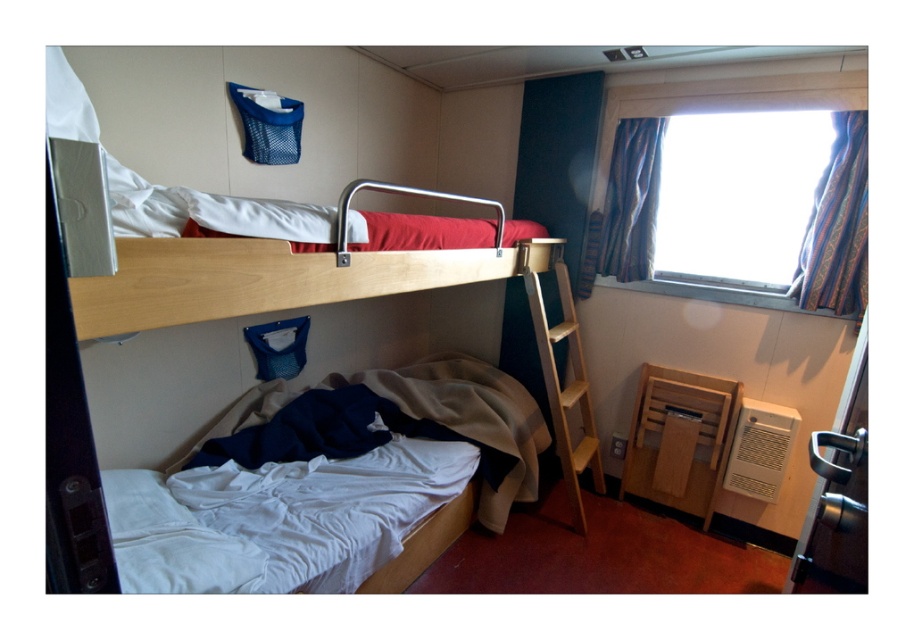
Question: Does multicolored woven curtain at window appear on the left side of wooden at right?

Choices:
 (A) no
 (B) yes

Answer: (A)

Question: Among these objects, which one is nearest to the camera?

Choices:
 (A) wooden bunk bed at center
 (B) striped fabric curtain at window
 (C) wooden at right
 (D) white cotton bed at lower left

Answer: (A)

Question: Can you confirm if wooden bunk bed at center is positioned to the right of translucent glass window at upper right?

Choices:
 (A) yes
 (B) no

Answer: (B)

Question: Which of these objects is positioned farthest from the striped fabric curtain at window?

Choices:
 (A) wooden bunk bed at center
 (B) multicolored woven curtain at window
 (C) white cotton bed at lower left

Answer: (C)

Question: Can you confirm if wooden bunk bed at center is bigger than striped fabric curtain at window?

Choices:
 (A) no
 (B) yes

Answer: (B)

Question: Which point is closer to the camera taking this photo?

Choices:
 (A) (729, 131)
 (B) (501, 264)
 (C) (815, 237)
 (D) (494, 502)

Answer: (B)